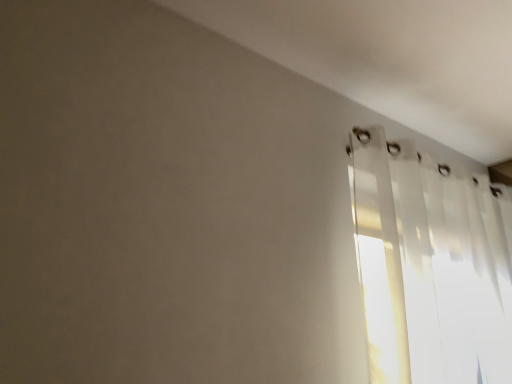
I want to click on transparent fabric curtain at right, so click(x=425, y=267).

Describe the element at coordinates (425, 267) in the screenshot. The image size is (512, 384). I see `transparent fabric curtain at right` at that location.

What is the approximate height of transparent fabric curtain at right?

The height of transparent fabric curtain at right is 3.55 feet.

Where is `transparent fabric curtain at right`? transparent fabric curtain at right is located at coordinates (425, 267).